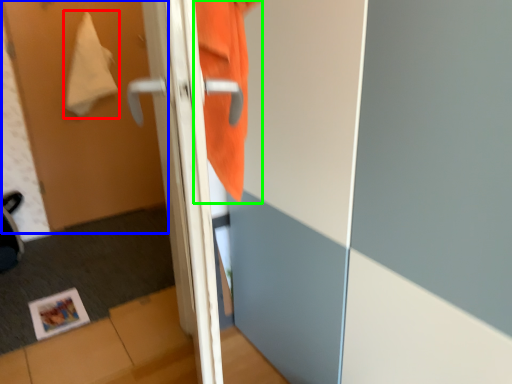
Question: Estimate the real-world distances between objects in this image. Which object is closer to blanket (highlighted by a red box), screen door (highlighted by a blue box) or sweatshirt (highlighted by a green box)?

Choices:
 (A) screen door
 (B) sweatshirt

Answer: (A)